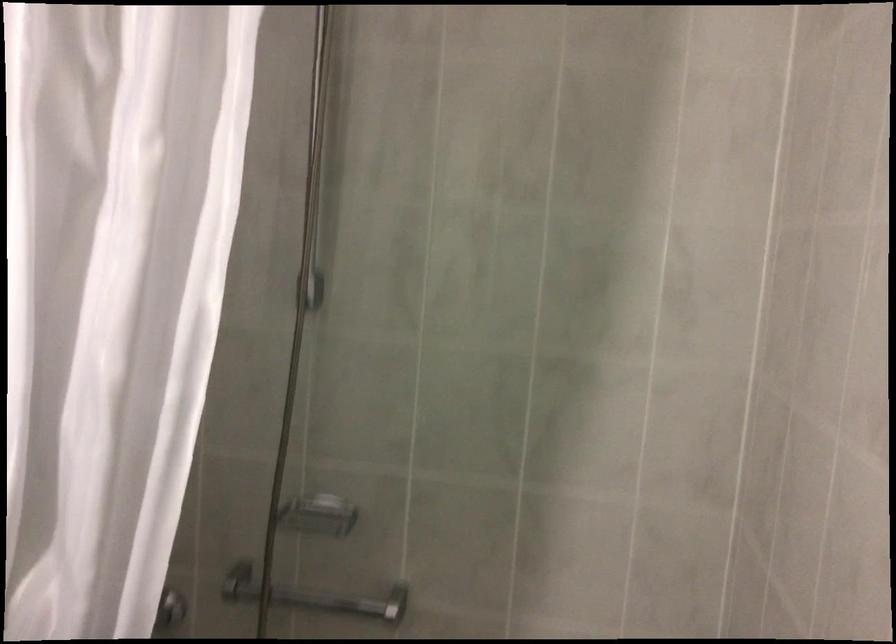
Find where to grip the metal grab bar. Please return your answer as a coordinate pair (x, y).

(314, 597)